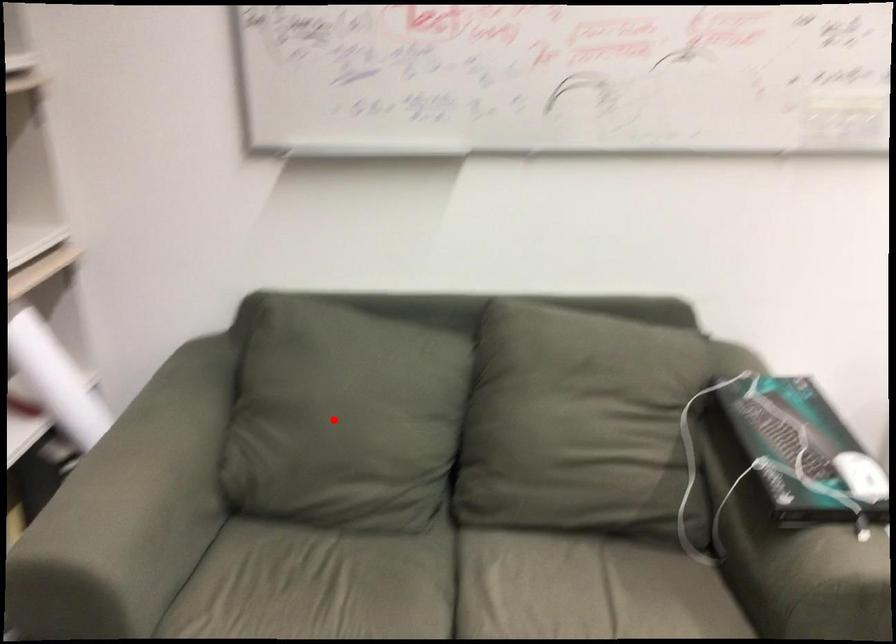
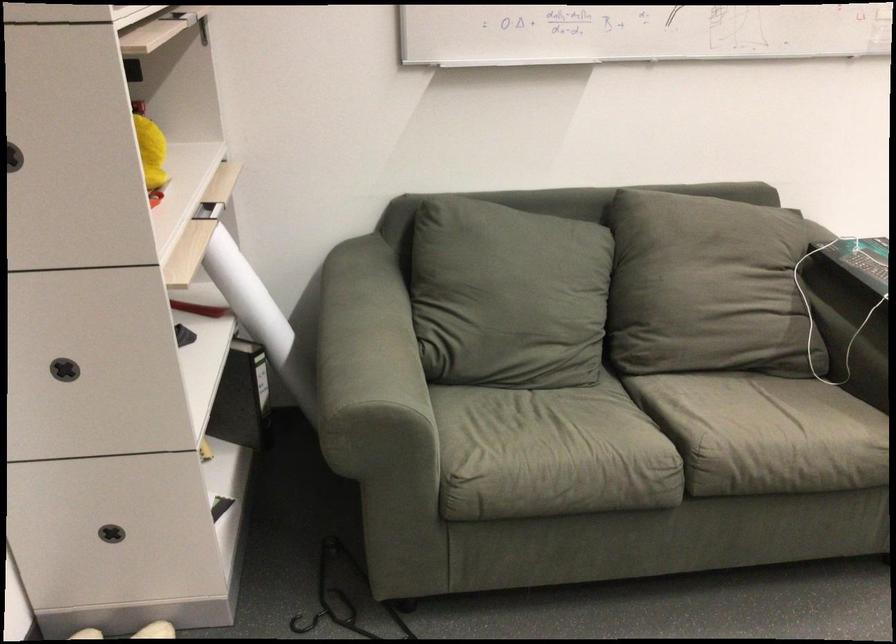
Find the pixel in the second image that matches the highlighted location in the first image.

(506, 295)